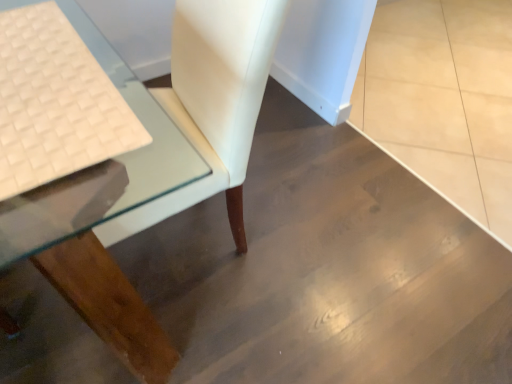
Question: From a real-world perspective, is clear glass table at lower left positioned above or below white woven fabric at left?

Choices:
 (A) above
 (B) below

Answer: (B)

Question: Do you think clear glass table at lower left is within white woven fabric at left, or outside of it?

Choices:
 (A) inside
 (B) outside

Answer: (B)

Question: In terms of width, does clear glass table at lower left look wider or thinner when compared to white woven fabric at left?

Choices:
 (A) thin
 (B) wide

Answer: (B)

Question: In the image, is white woven fabric at left on the left side or the right side of clear glass table at lower left?

Choices:
 (A) left
 (B) right

Answer: (A)

Question: From the image's perspective, is white woven fabric at left positioned above or below clear glass table at lower left?

Choices:
 (A) above
 (B) below

Answer: (B)

Question: Is white woven fabric at left taller or shorter than clear glass table at lower left?

Choices:
 (A) short
 (B) tall

Answer: (A)

Question: In terms of width, does white woven fabric at left look wider or thinner when compared to clear glass table at lower left?

Choices:
 (A) thin
 (B) wide

Answer: (A)